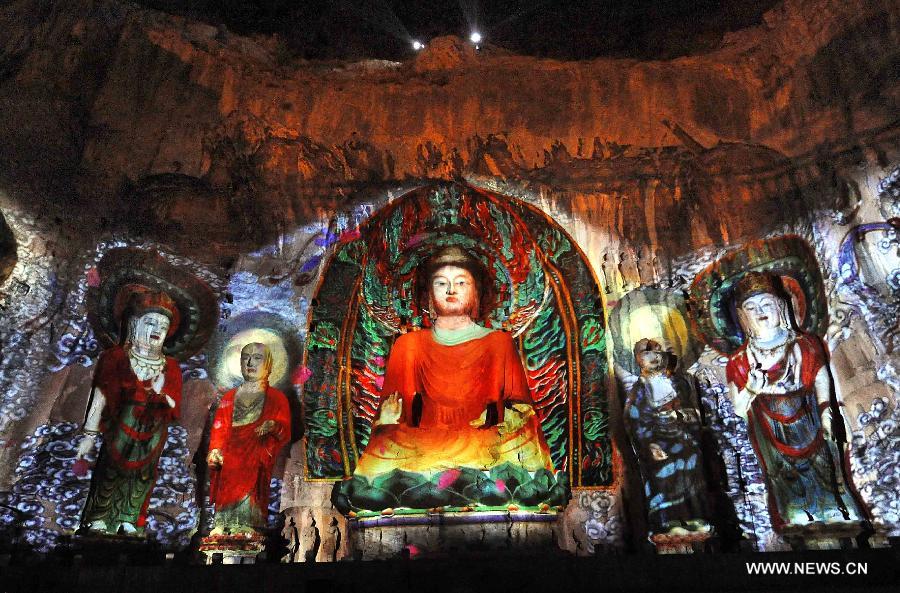
Locate an element on the screen. This screenshot has height=593, width=900. robes is located at coordinates (461, 401), (231, 454).